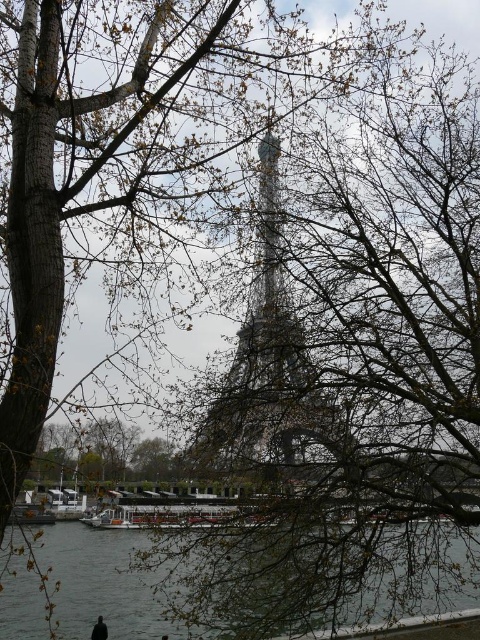
Question: Which point is closer to the camera?

Choices:
 (A) metallic silver eiffel tower at center
 (B) gray water at lower center

Answer: (B)

Question: Does metallic silver eiffel tower at center lie behind gray water at lower center?

Choices:
 (A) yes
 (B) no

Answer: (A)

Question: Which object appears farthest from the camera in this image?

Choices:
 (A) gray water at lower center
 (B) metallic silver eiffel tower at center

Answer: (B)

Question: Can you confirm if metallic silver eiffel tower at center is positioned to the right of gray water at lower center?

Choices:
 (A) yes
 (B) no

Answer: (A)

Question: Which point is closer to the camera?

Choices:
 (A) gray water at lower center
 (B) metallic silver eiffel tower at center

Answer: (A)

Question: Is metallic silver eiffel tower at center behind gray water at lower center?

Choices:
 (A) no
 (B) yes

Answer: (B)